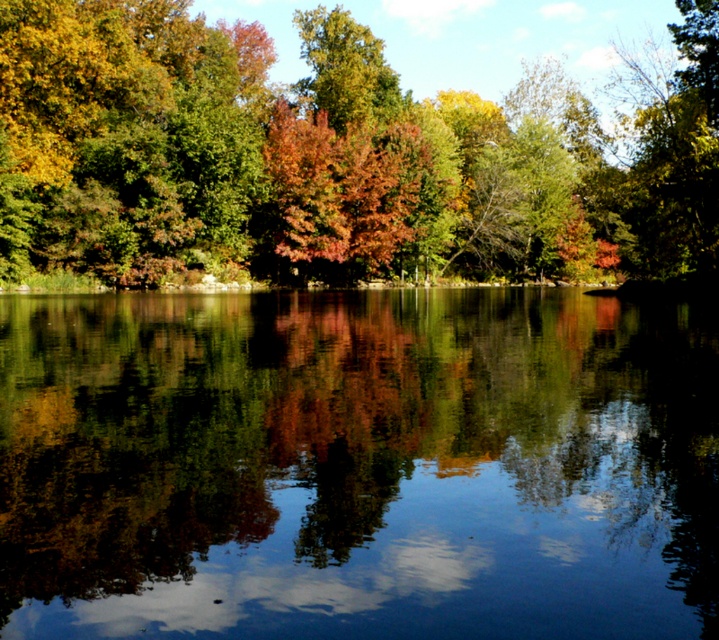
Question: Which point appears farthest from the camera in this image?

Choices:
 (A) (595, 221)
 (B) (308, 228)
 (C) (361, 452)

Answer: (A)

Question: Is autumn leaves at center wider than shiny red leaves at center?

Choices:
 (A) yes
 (B) no

Answer: (A)

Question: Is transparent glass water at center below shiny red leaves at center?

Choices:
 (A) no
 (B) yes

Answer: (B)

Question: Which point is farther from the camera taking this photo?

Choices:
 (A) (334, 164)
 (B) (505, 388)

Answer: (A)

Question: Estimate the real-world distances between objects in this image. Which object is farther from the autumn leaves at center?

Choices:
 (A) shiny red leaves at center
 (B) transparent glass water at center

Answer: (B)

Question: Considering the relative positions of transparent glass water at center and autumn leaves at center in the image provided, where is transparent glass water at center located with respect to autumn leaves at center?

Choices:
 (A) right
 (B) left

Answer: (B)